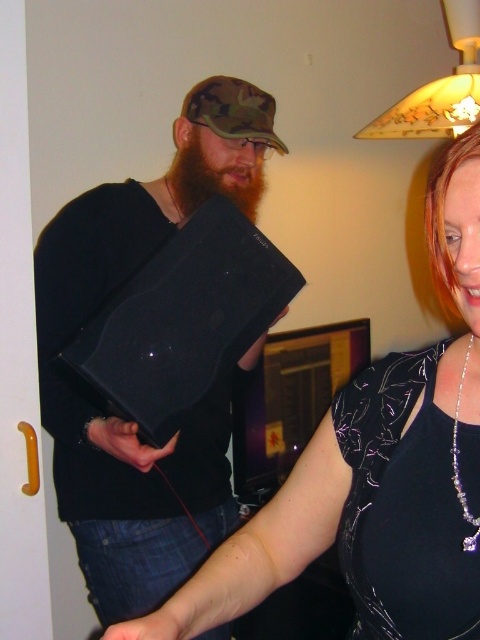
You are sitting at a table and see the matte black laptop at left and the blonde shiny hair at upper right. Which object is positioned lower in the image?

The matte black laptop at left is positioned below the blonde shiny hair at upper right, so the laptop is lower.

You are standing in front of the scene and want to take a photo of the blonde shiny hair at upper right without the matte black laptop at left blocking the view. Is this possible?

The matte black laptop at left is further to the viewer than the blonde shiny hair at upper right, so the laptop would block the view of the blonde shiny hair at upper right. Therefore, it is not possible to take a photo of the blonde shiny hair at upper right without the laptop blocking the view.

You are organizing a small event and need to place a matte black laptop at left and a silver metallic necklace at upper right on a shelf. The shelf has a width of 1.2 meters. Can both items fit side by side without overlapping?

The matte black laptop at left is wider than the silver metallic necklace at upper right. Since the shelf is 1.2 meters wide, both items can fit side by side as their combined width is less than 1.2 meters, assuming their individual widths add up to under that measurement. However, exact dimensions are not provided, so this depends on their actual sizes.